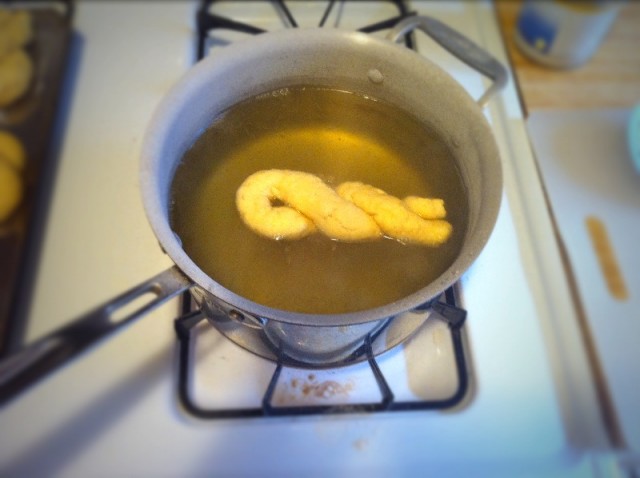
The image size is (640, 478). In order to click on hole in cutting board in this screenshot , I will do `click(609, 259)`.